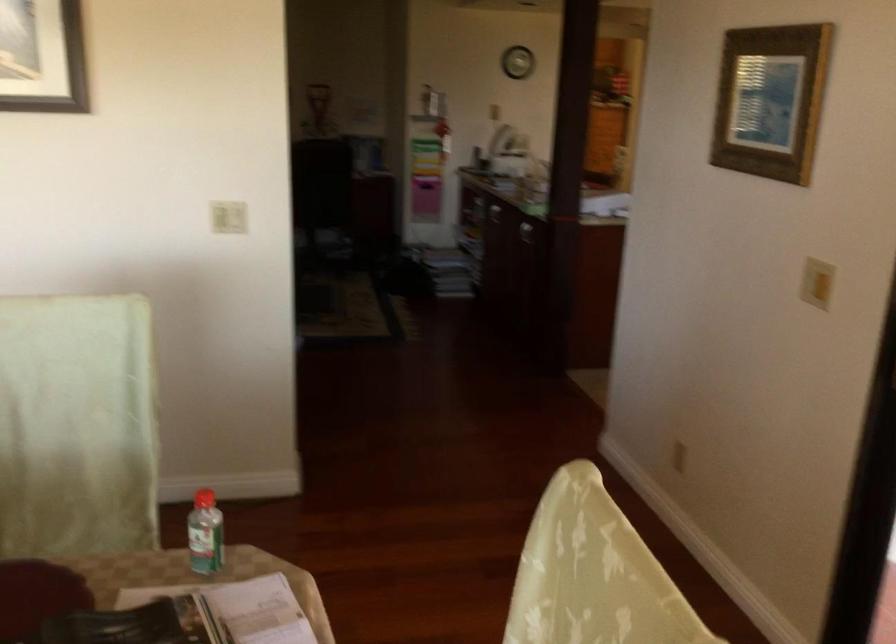
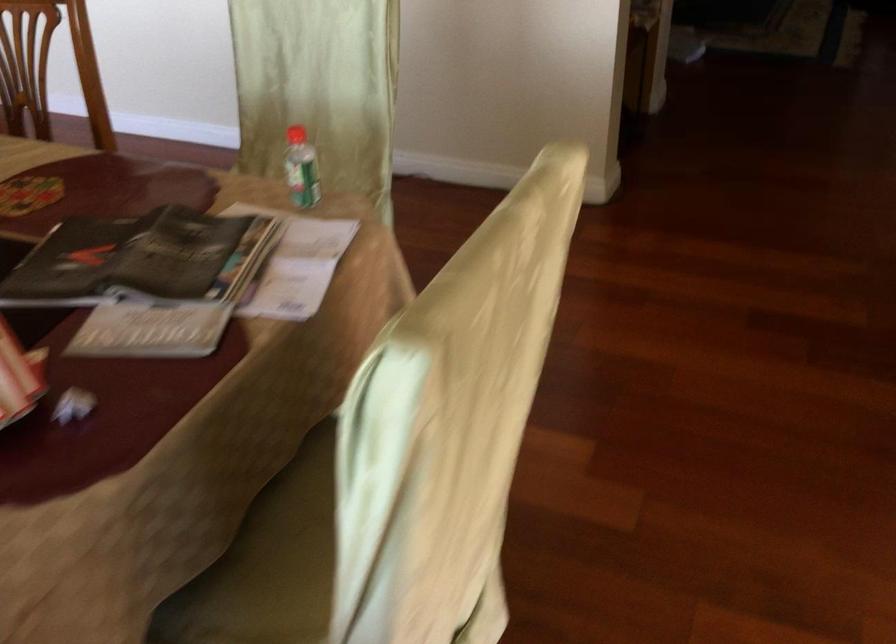
Where in the second image is the point corresponding to point 207,505 from the first image?

(296, 135)